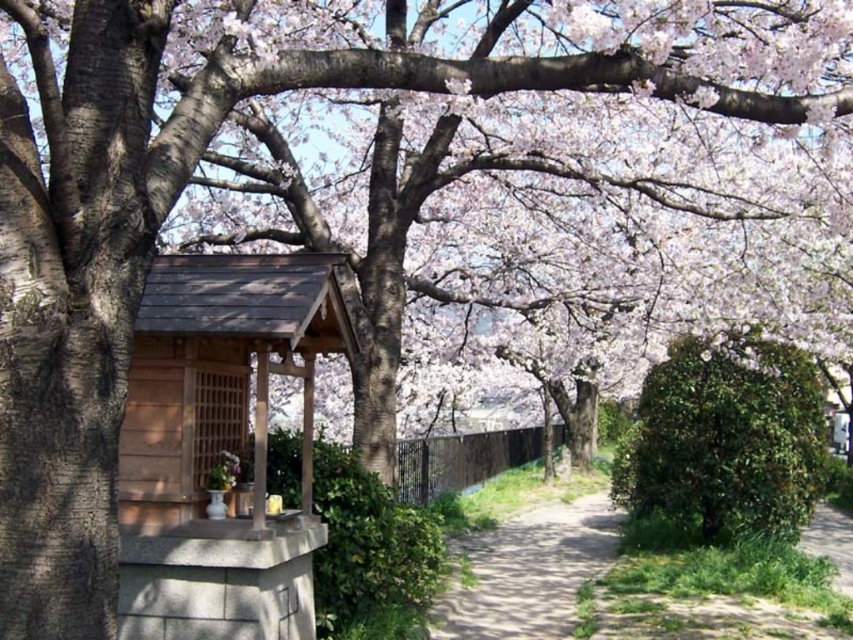
You are a hiker who wants to take a photo of the green leafy bush at center and the dirt path at lower right. Which object should you focus on first if you want to capture both in one frame without moving your camera?

You should focus on the green leafy bush at center first because it is taller than the dirt path at lower right, so it will appear closer to the camera and ensure both are in focus.

You are a tourist walking along the dirt path at lower right and want to take a photo of the green leafy bush at center. Which direction should you face to get the bush in your camera view?

You should face to the left to capture the green leafy bush at center in your photo because it is positioned to the left of the dirt path at lower right.